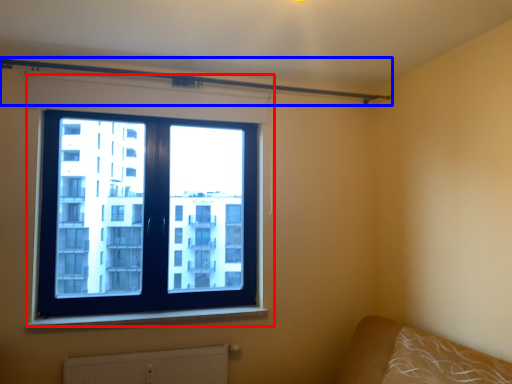
Question: Among these objects, which one is nearest to the camera, window (highlighted by a red box) or beam (highlighted by a blue box)?

Choices:
 (A) window
 (B) beam

Answer: (B)